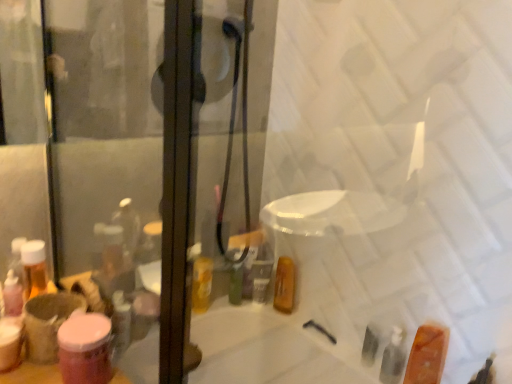
The image size is (512, 384). Describe the element at coordinates (426, 355) in the screenshot. I see `translucent orange soap at lower right, arranged as the first toiletry when ordered from the bottom` at that location.

Find the location of a particular element. Image resolution: width=512 pixels, height=384 pixels. translucent orange soap at lower right, arranged as the first toiletry when viewed from the back is located at coordinates (426, 355).

What is the approximate height of translucent orange soap at lower right, the 2th toiletry viewed from the front?

translucent orange soap at lower right, the 2th toiletry viewed from the front, is 20.96 centimeters in height.

The image size is (512, 384). What do you see at coordinates (85, 349) in the screenshot? I see `pink matte jar at lower left, the first toiletry when ordered from front to back` at bounding box center [85, 349].

The height and width of the screenshot is (384, 512). I want to click on pink matte jar at lower left, marked as the 2th toiletry in a bottom-to-top arrangement, so click(x=85, y=349).

Locate an element on the screen. The height and width of the screenshot is (384, 512). translucent orange soap at lower right, placed as the 2th toiletry when sorted from top to bottom is located at coordinates (426, 355).

Does translucent orange soap at lower right, arranged as the first toiletry when viewed from the back, appear on the left side of pink matte jar at lower left, which appears as the second toiletry when viewed from the right?

Incorrect, translucent orange soap at lower right, arranged as the first toiletry when viewed from the back, is not on the left side of pink matte jar at lower left, which appears as the second toiletry when viewed from the right.

Considering the positions of objects translucent orange soap at lower right, arranged as the first toiletry when viewed from the back, and pink matte jar at lower left, acting as the first toiletry starting from the left, in the image provided, who is behind, translucent orange soap at lower right, arranged as the first toiletry when viewed from the back, or pink matte jar at lower left, acting as the first toiletry starting from the left,?

Result: Positioned behind is translucent orange soap at lower right, arranged as the first toiletry when viewed from the back.

Which is closer, (423, 334) or (90, 318)?

Clearly, point (423, 334) is more distant from the camera than point (90, 318).

From the image's perspective, which is below, translucent orange soap at lower right, the 2th toiletry viewed from the front, or pink matte jar at lower left, the 2th toiletry from the back?

translucent orange soap at lower right, the 2th toiletry viewed from the front, is shown below in the image.

From a real-world perspective, is translucent orange soap at lower right, the 2th toiletry viewed from the front, above or below pink matte jar at lower left, the first toiletry when ordered from front to back?

Clearly, from a real-world perspective, translucent orange soap at lower right, the 2th toiletry viewed from the front, is below pink matte jar at lower left, the first toiletry when ordered from front to back.

Is translucent orange soap at lower right, arranged as the first toiletry when viewed from the back, wider than pink matte jar at lower left, which ranks as the 1th toiletry in top-to-bottom order?

Yes, translucent orange soap at lower right, arranged as the first toiletry when viewed from the back, is wider than pink matte jar at lower left, which ranks as the 1th toiletry in top-to-bottom order.

Is translucent orange soap at lower right, marked as the second toiletry in a left-to-right arrangement, taller or shorter than pink matte jar at lower left, the first toiletry when ordered from front to back?

Clearly, translucent orange soap at lower right, marked as the second toiletry in a left-to-right arrangement, is taller compared to pink matte jar at lower left, the first toiletry when ordered from front to back.

In terms of size, does translucent orange soap at lower right, arranged as the first toiletry when viewed from the back, appear bigger or smaller than pink matte jar at lower left, which ranks as the 1th toiletry in top-to-bottom order?

translucent orange soap at lower right, arranged as the first toiletry when viewed from the back, is bigger than pink matte jar at lower left, which ranks as the 1th toiletry in top-to-bottom order.

Is translucent orange soap at lower right, the 1th toiletry viewed from the right, outside of pink matte jar at lower left, marked as the 2th toiletry in a bottom-to-top arrangement?

Yes, translucent orange soap at lower right, the 1th toiletry viewed from the right, is not within pink matte jar at lower left, marked as the 2th toiletry in a bottom-to-top arrangement.

Based on the photo, is translucent orange soap at lower right, the 2th toiletry viewed from the front, not near pink matte jar at lower left, which ranks as the 1th toiletry in top-to-bottom order?

No, translucent orange soap at lower right, the 2th toiletry viewed from the front, is not far away from pink matte jar at lower left, which ranks as the 1th toiletry in top-to-bottom order.

Is translucent orange soap at lower right, the 2th toiletry viewed from the front, looking in the opposite direction of pink matte jar at lower left, the first toiletry when ordered from front to back?

translucent orange soap at lower right, the 2th toiletry viewed from the front, does not have its back to pink matte jar at lower left, the first toiletry when ordered from front to back.

How much distance is there between translucent orange soap at lower right, arranged as the first toiletry when viewed from the back, and pink matte jar at lower left, the first toiletry when ordered from front to back?

translucent orange soap at lower right, arranged as the first toiletry when viewed from the back, is 31.50 inches from pink matte jar at lower left, the first toiletry when ordered from front to back.

The width and height of the screenshot is (512, 384). Identify the location of toiletry located behind the pink matte jar at lower left, which appears as the second toiletry when viewed from the right. (426, 355).

Considering the positions of objects pink matte jar at lower left, the first toiletry when ordered from front to back, and translucent orange soap at lower right, the 1th toiletry viewed from the right, in the image provided, who is more to the left, pink matte jar at lower left, the first toiletry when ordered from front to back, or translucent orange soap at lower right, the 1th toiletry viewed from the right,?

pink matte jar at lower left, the first toiletry when ordered from front to back, is more to the left.

Is pink matte jar at lower left, acting as the first toiletry starting from the left, in front of translucent orange soap at lower right, the 1th toiletry viewed from the right?

Yes, pink matte jar at lower left, acting as the first toiletry starting from the left, is in front of translucent orange soap at lower right, the 1th toiletry viewed from the right.

Which is closer, (90, 335) or (419, 344)?

Clearly, point (90, 335) is closer to the camera than point (419, 344).

Looking at this image, from the image's perspective, which is below, pink matte jar at lower left, marked as the 2th toiletry in a bottom-to-top arrangement, or translucent orange soap at lower right, arranged as the first toiletry when ordered from the bottom?

translucent orange soap at lower right, arranged as the first toiletry when ordered from the bottom, is shown below in the image.

From a real-world perspective, is pink matte jar at lower left, the 2th toiletry from the back, located higher than translucent orange soap at lower right, the 2th toiletry viewed from the front?

Indeed, from a real-world perspective, pink matte jar at lower left, the 2th toiletry from the back, stands above translucent orange soap at lower right, the 2th toiletry viewed from the front.

Which object is wider, pink matte jar at lower left, which appears as the second toiletry when viewed from the right, or translucent orange soap at lower right, placed as the 2th toiletry when sorted from top to bottom?

With larger width is translucent orange soap at lower right, placed as the 2th toiletry when sorted from top to bottom.

Considering the relative sizes of pink matte jar at lower left, the first toiletry when ordered from front to back, and translucent orange soap at lower right, the 1th toiletry viewed from the right, in the image provided, is pink matte jar at lower left, the first toiletry when ordered from front to back, taller than translucent orange soap at lower right, the 1th toiletry viewed from the right,?

Incorrect, the height of pink matte jar at lower left, the first toiletry when ordered from front to back, is not larger of that of translucent orange soap at lower right, the 1th toiletry viewed from the right.

Is pink matte jar at lower left, marked as the 2th toiletry in a bottom-to-top arrangement, bigger than translucent orange soap at lower right, arranged as the first toiletry when viewed from the back?

Actually, pink matte jar at lower left, marked as the 2th toiletry in a bottom-to-top arrangement, might be smaller than translucent orange soap at lower right, arranged as the first toiletry when viewed from the back.

Is translucent orange soap at lower right, marked as the second toiletry in a left-to-right arrangement, surrounded by pink matte jar at lower left, the 2th toiletry from the back?

No.

Is pink matte jar at lower left, which appears as the second toiletry when viewed from the right, far from translucent orange soap at lower right, arranged as the first toiletry when viewed from the back?

No, pink matte jar at lower left, which appears as the second toiletry when viewed from the right, is not far away from translucent orange soap at lower right, arranged as the first toiletry when viewed from the back.

Is pink matte jar at lower left, which ranks as the 1th toiletry in top-to-bottom order, facing towards translucent orange soap at lower right, arranged as the first toiletry when ordered from the bottom?

No, pink matte jar at lower left, which ranks as the 1th toiletry in top-to-bottom order, is not turned towards translucent orange soap at lower right, arranged as the first toiletry when ordered from the bottom.

The width and height of the screenshot is (512, 384). Identify the location of toiletry below the pink matte jar at lower left, which appears as the second toiletry when viewed from the right (from a real-world perspective). (426, 355).

You are a GUI agent. You are given a task and a screenshot of the screen. Output one action in this format:
    pyautogui.click(x=<x>, y=<y>)
    Task: Click on the toiletry on the right of pink matte jar at lower left, acting as the first toiletry starting from the left
    The image size is (512, 384).
    Given the screenshot: What is the action you would take?
    pyautogui.click(x=426, y=355)

Find the location of a particular element. The width and height of the screenshot is (512, 384). toiletry above the translucent orange soap at lower right, placed as the 2th toiletry when sorted from top to bottom (from the image's perspective) is located at coordinates [x=85, y=349].